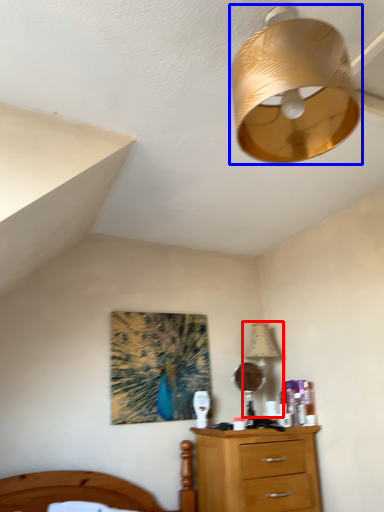
Question: Which of the following is the closest to the observer, table lamp (highlighted by a red box) or lamp (highlighted by a blue box)?

Choices:
 (A) table lamp
 (B) lamp

Answer: (B)